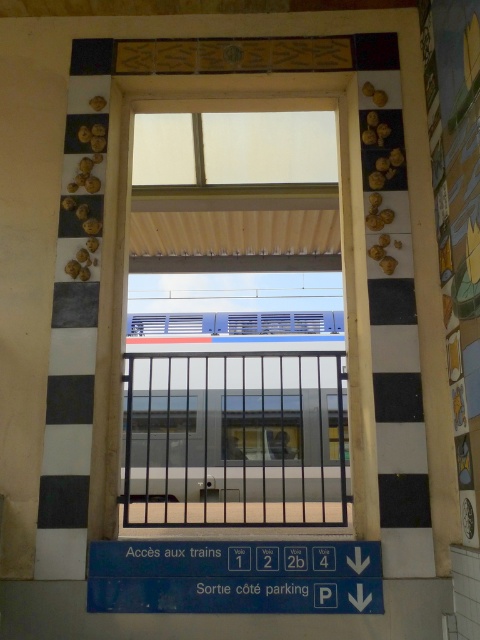
You are standing at the center of the train station platform. You want to locate the silver metallic rail at center. Based on its 2D coordinates, in which direction should you look relative to your position?

The silver metallic rail at center is located at coordinates 0.688 on the x axis and 0.490 on the y axis. Since you are at the center of the platform, which would be coordinate 0.5 on both axes, you should look slightly to the right and straight ahead to locate it.

You are a maintenance worker needing to inspect the silver metallic rail at center. Given that you can only reach up to 16 feet, will you be able to reach it without any tools?

The silver metallic rail at center is 17.05 feet from the camera, which is beyond your 16 feet reach. Therefore, you cannot reach it without tools.

Based on the photo, you are a passenger waiting at the station and see the silver metallic rail at center and the transparent glass train at center. Which object is closer to you as you look through the window?

The silver metallic rail at center is closer to you because it is in front of the transparent glass train at center.